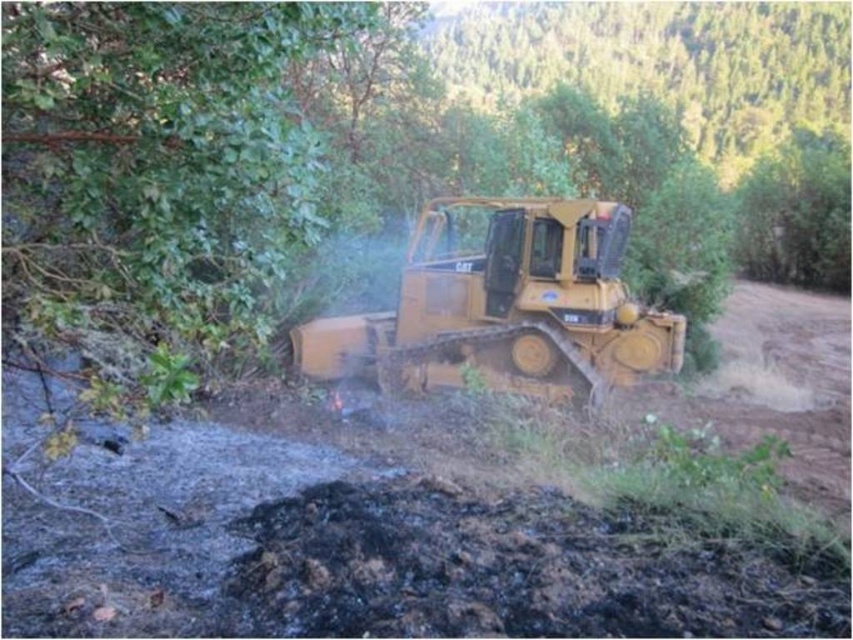
Does charcoal soil at lower center have a larger size compared to matte yellow tractor at center?

No.

Can you confirm if charcoal soil at lower center is shorter than matte yellow tractor at center?

Yes.

Measure the distance between point (607, 600) and camera.

They are 3.63 meters apart.

The width and height of the screenshot is (853, 640). Identify the location of charcoal soil at lower center. (506, 572).